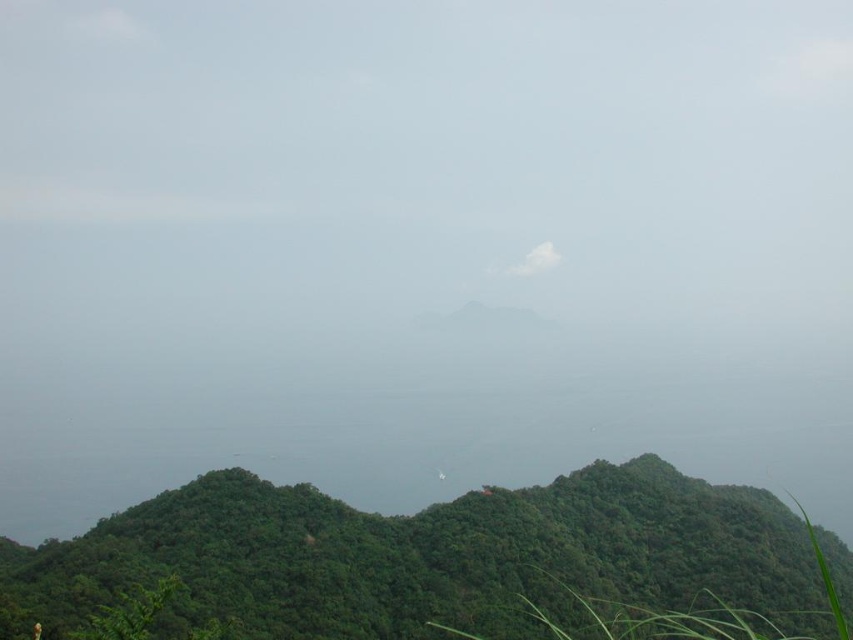
You are an artist trying to paint the scene. You have two brushes, one for the green leafy vegetation at center and another for the white fluffy cloud at center. Which brush should you use first if you want to paint the larger object first?

You should paint the green leafy vegetation at center first because it is larger than the white fluffy cloud at center according to the description.

You are standing in the forested area at the foreground of the scene. You notice two points marked in the image. Which point, point (310, 577) or point (556, 262), is nearer to you?

Point (310, 577) is closer to the viewer than point (556, 262), so the point (310, 577) is nearer to you.

In the serene landscape scene with lush greenery and a vast body of water, there is a point marked at coordinates (431, 556). What is located at this point?

The point at coordinates (431, 556) indicates green leafy vegetation at center.